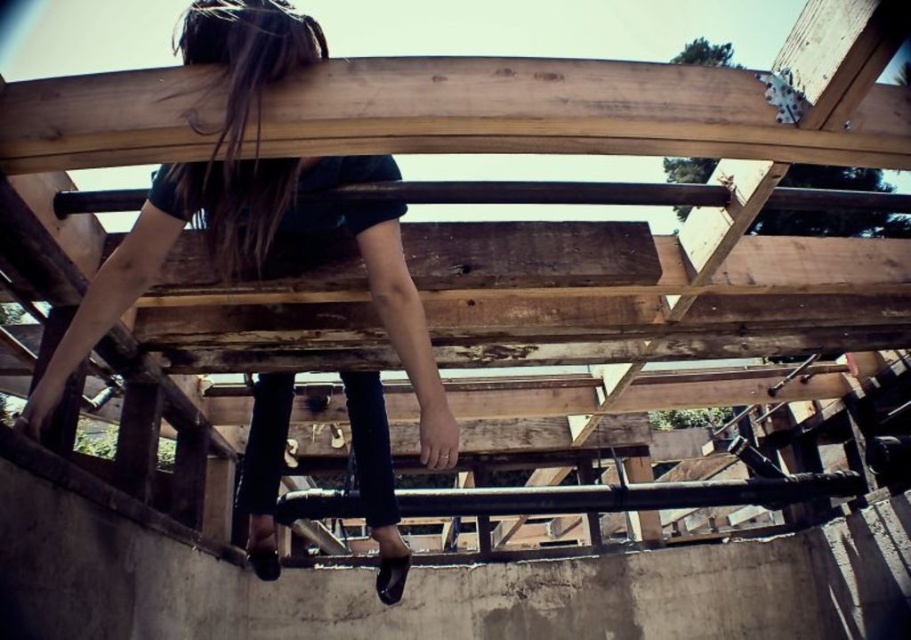
Is matte black hair at upper center to the right of brown/dry hair at upper center from the viewer's perspective?

Indeed, matte black hair at upper center is positioned on the right side of brown/dry hair at upper center.

Does matte black hair at upper center have a greater width compared to brown/dry hair at upper center?

Yes.

Between point (275, 429) and point (244, 92), which one is positioned in front?

Point (244, 92) is in front.

You are a GUI agent. You are given a task and a screenshot of the screen. Output one action in this format:
    pyautogui.click(x=<x>, y=<y>)
    Task: Click on the matte black hair at upper center
    
    Given the screenshot: What is the action you would take?
    pyautogui.click(x=258, y=212)